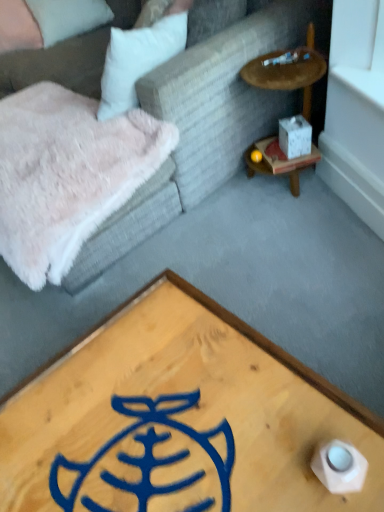
Question: From the image's perspective, is white matte cube at right located beneath velvet fabric couch at upper left?

Choices:
 (A) yes
 (B) no

Answer: (A)

Question: Does white matte cube at right touch velvet fabric couch at upper left?

Choices:
 (A) yes
 (B) no

Answer: (B)

Question: Can you confirm if white matte cube at right is taller than velvet fabric couch at upper left?

Choices:
 (A) yes
 (B) no

Answer: (B)

Question: Does white matte cube at right have a lesser height compared to velvet fabric couch at upper left?

Choices:
 (A) no
 (B) yes

Answer: (B)

Question: Does white matte cube at right have a lesser width compared to velvet fabric couch at upper left?

Choices:
 (A) no
 (B) yes

Answer: (B)

Question: Considering the relative sizes of white matte cube at right and velvet fabric couch at upper left in the image provided, is white matte cube at right smaller than velvet fabric couch at upper left?

Choices:
 (A) yes
 (B) no

Answer: (A)

Question: Is wooden coffee table at center smaller than white fluffy pillow at upper left, acting as the 2th pillow starting from the right?

Choices:
 (A) no
 (B) yes

Answer: (A)

Question: Is wooden coffee table at center at the right side of white fluffy pillow at upper left, acting as the 2th pillow starting from the right?

Choices:
 (A) yes
 (B) no

Answer: (A)

Question: Does wooden coffee table at center have a greater height compared to white fluffy pillow at upper left, acting as the 2th pillow starting from the right?

Choices:
 (A) yes
 (B) no

Answer: (B)

Question: Is wooden coffee table at center oriented away from white fluffy pillow at upper left, acting as the 2th pillow starting from the right?

Choices:
 (A) no
 (B) yes

Answer: (A)

Question: Is white fluffy pillow at upper left, which is the 1th pillow in left-to-right order, completely or partially inside wooden coffee table at center?

Choices:
 (A) no
 (B) yes

Answer: (A)

Question: Is wooden coffee table at center not inside white fluffy pillow at upper left, which is the 1th pillow in left-to-right order?

Choices:
 (A) no
 (B) yes

Answer: (B)

Question: Does white fluffy pillow at upper left, acting as the 2th pillow starting from the right, have a greater height compared to beige fabric pillow at upper left, the 1th pillow in the right-to-left sequence?

Choices:
 (A) no
 (B) yes

Answer: (B)